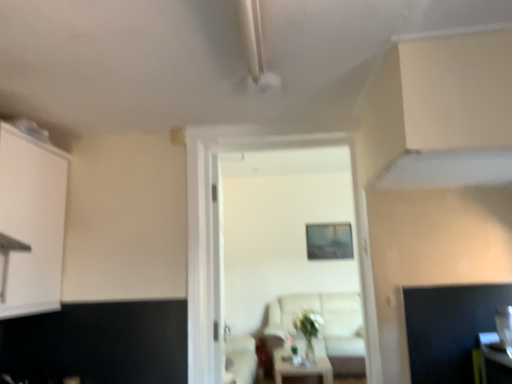
Where is `beige fabric couch at center`? Image resolution: width=512 pixels, height=384 pixels. beige fabric couch at center is located at coordinates (324, 326).

Where is `white glossy table at center`? This screenshot has width=512, height=384. white glossy table at center is located at coordinates (301, 367).

Looking at this image, measure the distance between white matte cabinet at left and camera.

white matte cabinet at left and camera are 1.72 meters apart.

This screenshot has width=512, height=384. In order to click on transparent glass door at center in this screenshot , I will do `click(217, 272)`.

How different are the orientations of white glossy table at center and beige fabric couch at center in degrees?

The facing directions of white glossy table at center and beige fabric couch at center are 1.71 degrees apart.

Which of these two, white glossy table at center or beige fabric couch at center, stands shorter?

white glossy table at center.

Would you say white glossy table at center is a long distance from beige fabric couch at center?

They are positioned close to each other.

Find the location of a particular element. The height and width of the screenshot is (384, 512). table in front of the beige fabric couch at center is located at coordinates (301, 367).

Is beige fabric couch at center not close to white wooden door at center?

beige fabric couch at center is far away from white wooden door at center.

Is point (268, 347) less distant than point (206, 253)?

That is False.

The height and width of the screenshot is (384, 512). I want to click on door in front of the beige fabric couch at center, so click(x=216, y=238).

Does point (328, 362) appear closer or farther from the camera than point (226, 130)?

Point (328, 362) is positioned farther from the camera compared to point (226, 130).

Based on the photo, which is more to the right, white glossy table at center or white wooden door at center?

white glossy table at center.

Is white glossy table at center taller or shorter than white wooden door at center?

In the image, white glossy table at center appears to be shorter than white wooden door at center.

Is white glossy table at center next to white wooden door at center and touching it?

No, white glossy table at center is not beside white wooden door at center.

From the image's perspective, is white matte cabinet at left over transparent glass door at center?

Indeed, from the image's perspective, white matte cabinet at left is shown above transparent glass door at center.

Between white matte cabinet at left and transparent glass door at center, which one has less height?

white matte cabinet at left.

Which of these two, white matte cabinet at left or transparent glass door at center, is thinner?

transparent glass door at center is thinner.

In order to click on glass door below the white matte cabinet at left (from a real-world perspective) in this screenshot , I will do `click(217, 272)`.

Looking at the image, does transparent glass door at center seem bigger or smaller compared to beige fabric couch at center?

Considering their sizes, transparent glass door at center takes up less space than beige fabric couch at center.

From the image's perspective, does transparent glass door at center appear lower than beige fabric couch at center?

No, from the image's perspective, transparent glass door at center is not below beige fabric couch at center.

Is transparent glass door at center positioned before beige fabric couch at center?

Yes, transparent glass door at center is closer to the camera.

In terms of width, does white matte cabinet at left look wider or thinner when compared to white wooden door at center?

Clearly, white matte cabinet at left has less width compared to white wooden door at center.

Are white matte cabinet at left and white wooden door at center beside each other?

white matte cabinet at left and white wooden door at center are clearly separated.

In the scene shown: Do you think white matte cabinet at left is within white wooden door at center, or outside of it?

white matte cabinet at left lies outside white wooden door at center.

From the image's perspective, which is above, white matte cabinet at left or white wooden door at center?

white matte cabinet at left.

Between white wooden door at center and transparent glass door at center, which one has smaller width?

With smaller width is transparent glass door at center.

Are white wooden door at center and transparent glass door at center located far from each other?

No, white wooden door at center is not far away from transparent glass door at center.

Is white wooden door at center aimed at transparent glass door at center?

No, white wooden door at center is not aimed at transparent glass door at center.

Looking at this image, how many degrees apart are the facing directions of white wooden door at center and transparent glass door at center?

white wooden door at center and transparent glass door at center are facing 98 degrees away from each other.

Identify the location of couch on the right of white glossy table at center. (324, 326).

Where is `door to the left of beige fabric couch at center`? door to the left of beige fabric couch at center is located at coordinates (216, 238).

When comparing their distances from beige fabric couch at center, does white wooden door at center or white glossy table at center seem closer?

Based on the image, white glossy table at center appears to be nearer to beige fabric couch at center.

Looking at the image, which one is located closer to white wooden door at center, white matte cabinet at left or beige fabric couch at center?

white matte cabinet at left is closer to white wooden door at center.

Based on their spatial positions, is white matte cabinet at left or transparent glass door at center closer to white wooden door at center?

transparent glass door at center is positioned closer to the anchor white wooden door at center.

Which object lies nearer to the anchor point white matte cabinet at left, white glossy table at center or transparent glass door at center?

Based on the image, transparent glass door at center appears to be nearer to white matte cabinet at left.

Estimate the real-world distances between objects in this image. Which object is closer to white matte cabinet at left, beige fabric couch at center or transparent glass door at center?

transparent glass door at center is closer to white matte cabinet at left.

From the image, which object appears to be nearer to white glossy table at center, white matte cabinet at left or white wooden door at center?

white wooden door at center is positioned closer to the anchor white glossy table at center.

Estimate the real-world distances between objects in this image. Which object is further from white wooden door at center, white matte cabinet at left or white glossy table at center?

Based on the image, white glossy table at center appears to be further to white wooden door at center.

Consider the image. Based on their spatial positions, is white matte cabinet at left or white wooden door at center further from beige fabric couch at center?

white matte cabinet at left lies further to beige fabric couch at center than the other object.

I want to click on glass door located between white matte cabinet at left and beige fabric couch at center in the depth direction, so click(x=217, y=272).

This screenshot has height=384, width=512. Identify the location of door located between white matte cabinet at left and beige fabric couch at center in the depth direction. click(216, 238).

Where is `glass door located between white matte cabinet at left and white glossy table at center in the depth direction`? This screenshot has height=384, width=512. glass door located between white matte cabinet at left and white glossy table at center in the depth direction is located at coordinates (217, 272).

Find the location of a particular element. This screenshot has width=512, height=384. table between white wooden door at center and beige fabric couch at center from front to back is located at coordinates (301, 367).